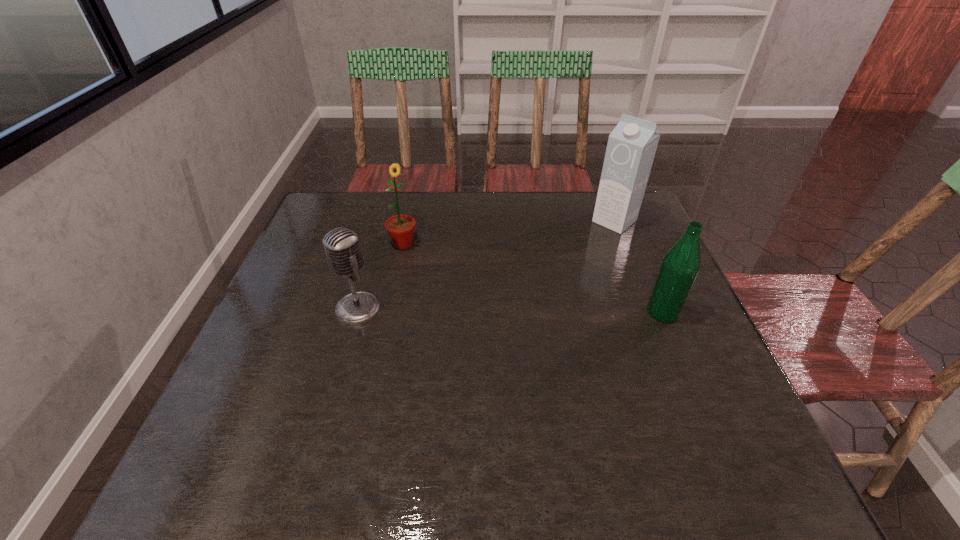
This screenshot has width=960, height=540. I want to click on vacant spot on the desktop that is between the microphone and the bottle and is positioned on the face of the sunflower, so tap(473, 310).

The width and height of the screenshot is (960, 540). In order to click on vacant space on the desktop that is between the microphone and the bottle and is positioned on the front label of the farthest object in this screenshot , I will do `click(509, 311)`.